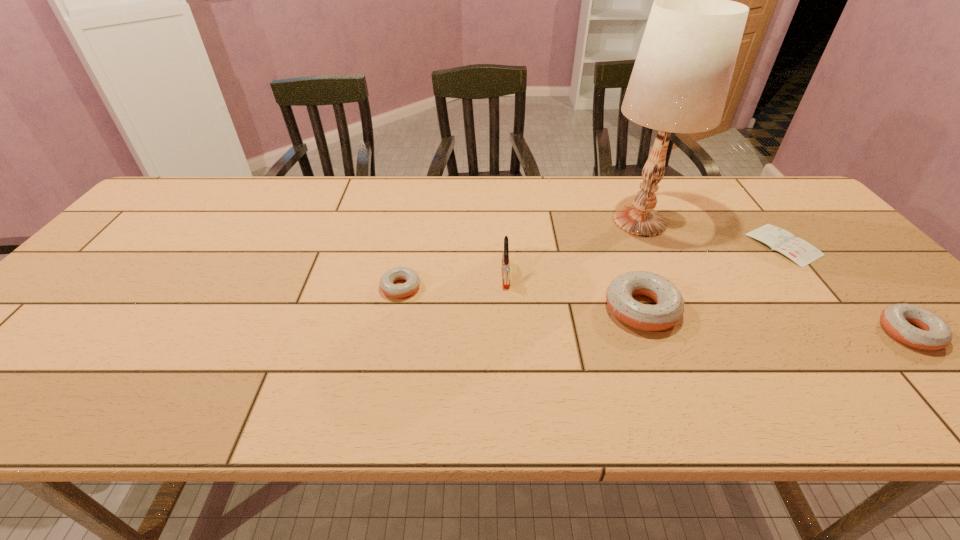
Where is `free space that satisfies the following two spatial constraints: 1. on the handle side of the fifth shortest object; 2. on the left side of the tallest doughnut`? free space that satisfies the following two spatial constraints: 1. on the handle side of the fifth shortest object; 2. on the left side of the tallest doughnut is located at coordinates (508, 309).

The width and height of the screenshot is (960, 540). In order to click on vacant region that satisfies the following two spatial constraints: 1. on the back side of the leftmost doughnut; 2. on the right side of the tallest object in this screenshot , I will do `click(414, 221)`.

Where is `vacant region that satisfies the following two spatial constraints: 1. on the handle side of the rightmost doughnut; 2. on the left side of the stapler`? The height and width of the screenshot is (540, 960). vacant region that satisfies the following two spatial constraints: 1. on the handle side of the rightmost doughnut; 2. on the left side of the stapler is located at coordinates (510, 333).